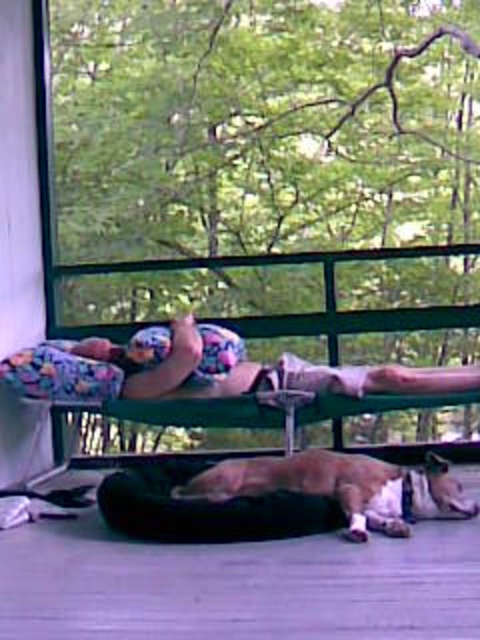
Question: Which of the following is the farthest from the observer?

Choices:
 (A) (264, 474)
 (B) (121, 396)
 (C) (334, 570)

Answer: (B)

Question: Does black fabric dog bed at lower center appear on the right side of brown fur dog at lower center?

Choices:
 (A) yes
 (B) no

Answer: (B)

Question: Does floral fabric person at center appear over brown fur dog at lower center?

Choices:
 (A) no
 (B) yes

Answer: (B)

Question: Which object appears closest to the camera in this image?

Choices:
 (A) black fabric dog bed at lower center
 (B) floral fabric person at center
 (C) brown fur dog at lower center

Answer: (A)

Question: Can you confirm if black fabric dog bed at lower center is positioned below brown fur dog at lower center?

Choices:
 (A) no
 (B) yes

Answer: (B)

Question: Among these objects, which one is farthest from the camera?

Choices:
 (A) brown fur dog at lower center
 (B) black fabric dog bed at lower center
 (C) floral fabric person at center

Answer: (C)